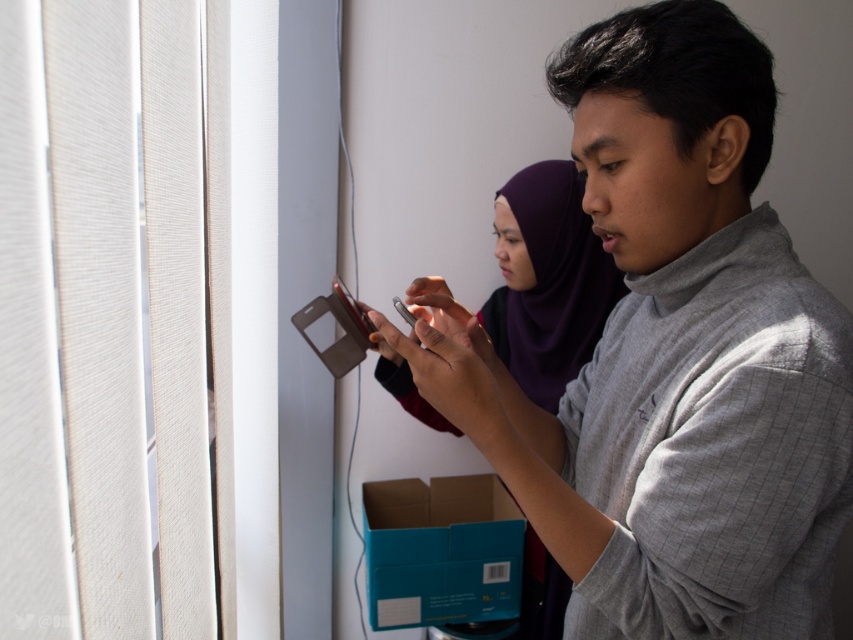
Question: Is teal cardboard box at lower center closer to the viewer compared to white paper at lower center?

Choices:
 (A) yes
 (B) no

Answer: (A)

Question: Is the position of teal cardboard box at lower center less distant than that of white paper at lower center?

Choices:
 (A) no
 (B) yes

Answer: (B)

Question: Which object is closer to the camera taking this photo?

Choices:
 (A) gray textured sweater at center
 (B) white paper at lower center

Answer: (A)

Question: Which object appears farthest from the camera in this image?

Choices:
 (A) gray textured sweater at center
 (B) teal cardboard box at lower center
 (C) white paper at lower center

Answer: (C)

Question: Which object appears closest to the camera in this image?

Choices:
 (A) gray textured sweater at center
 (B) teal cardboard box at lower center

Answer: (A)

Question: Is gray textured sweater at center thinner than white paper at lower center?

Choices:
 (A) yes
 (B) no

Answer: (B)